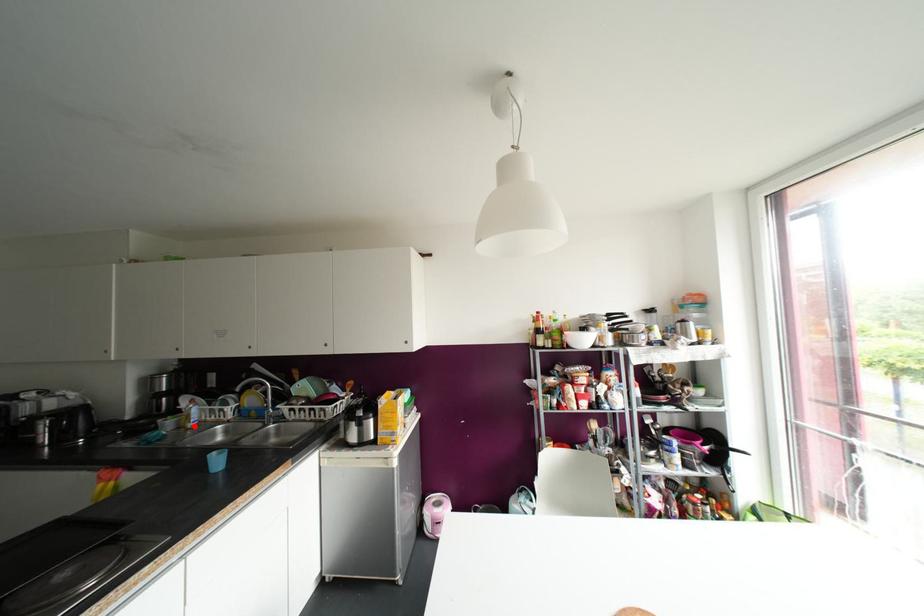
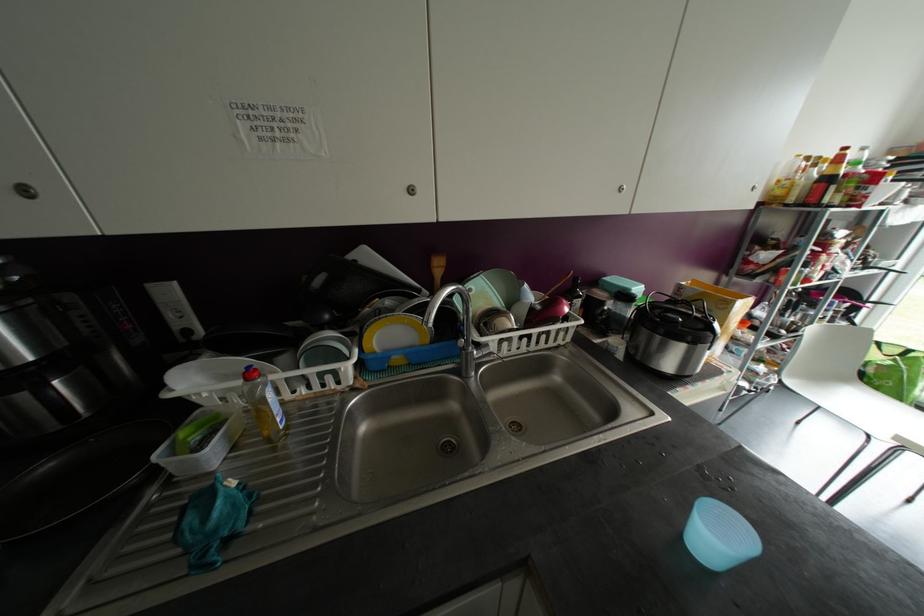
The point at the highlighted location is marked in the first image. Where is the corresponding point in the second image?

(286, 427)